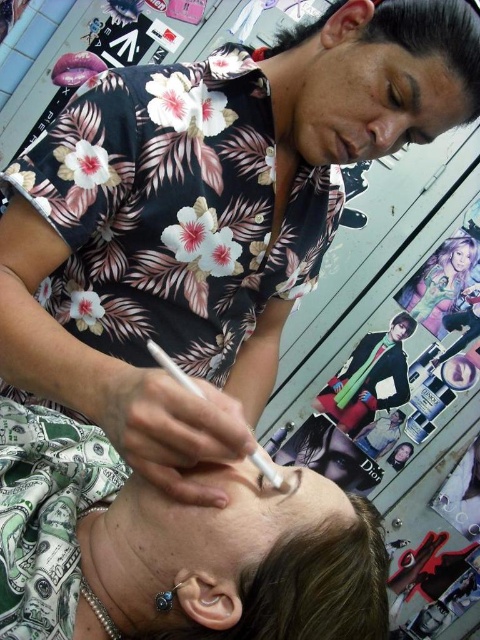
You are a makeup artist in the scene. You need to place a new makeup brush next to the white matte brush at upper center so it doesn t fall. Where should you place it relative to the matte plastic poster at upper right?

The matte plastic poster at upper right is smaller than the white matte brush at upper center, so placing the new makeup brush next to the white matte brush at upper center would be to the left or below the matte plastic poster at upper right to prevent it from falling.

You are a makeup artist working on a client. You need to place a matte green dollar bill at lower left on the table near the client. Where should you place it?

Place the matte green dollar bill at lower left at the coordinates point (x=176, y=547).

You are a makeup artist in the scene and want to place a small earring on the client. The matte green dollar bill at lower left and the matte plastic poster at upper right are nearby. Which object can you use as a surface to temporarily place the earring without it falling off, considering their sizes?

The matte green dollar bill at lower left has a larger width than the matte plastic poster at upper right, so it provides a more stable surface to temporarily place the earring without it falling off.